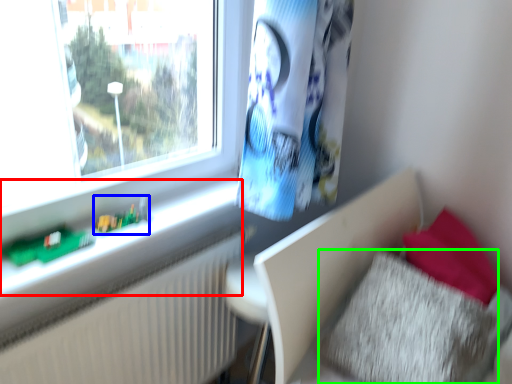
Question: Which is nearer to the window sill (highlighted by a red box)? toy (highlighted by a blue box) or pillow (highlighted by a green box).

Choices:
 (A) toy
 (B) pillow

Answer: (A)